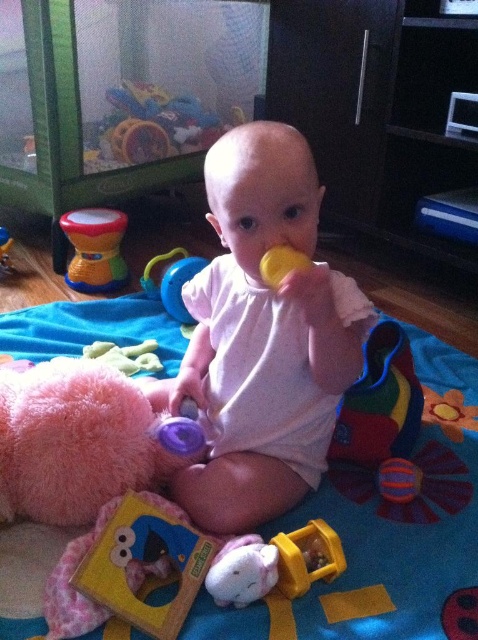
Who is positioned more to the left, yellow rubber teething ring at center or yellow rubber duck at center?

yellow rubber teething ring at center is more to the left.

The width and height of the screenshot is (478, 640). Identify the location of yellow rubber teething ring at center. (173, 282).

Does blue soft mat at center have a smaller size compared to yellow plastic teether at center?

No, blue soft mat at center is not smaller than yellow plastic teether at center.

Can you confirm if blue soft mat at center is positioned below yellow plastic teether at center?

Actually, blue soft mat at center is above yellow plastic teether at center.

Who is more distant from viewer, (454, 488) or (299, 570)?

The point (454, 488) is behind.

Locate an element on the screen. Image resolution: width=478 pixels, height=640 pixels. blue soft mat at center is located at coordinates (405, 524).

Which of these two, blue soft mat at center or rubberized yellow teething ring at center, stands shorter?

With less height is rubberized yellow teething ring at center.

Who is more forward, (424, 518) or (2, 243)?

Point (424, 518) is in front.

Is point (373, 490) more distant than point (3, 236)?

No, it is not.

Locate an element on the screen. Image resolution: width=478 pixels, height=640 pixels. blue soft mat at center is located at coordinates (405, 524).